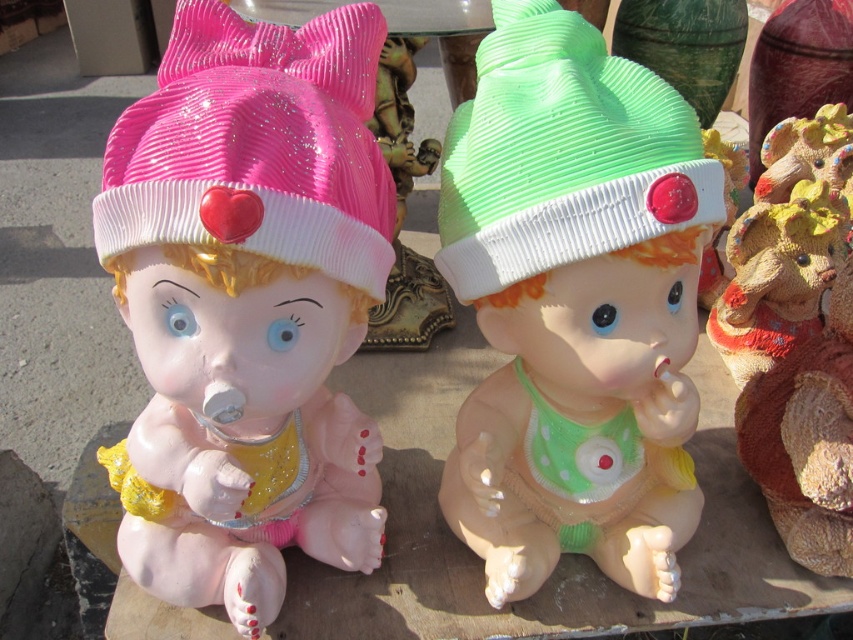
Question: Among these points, which one is nearest to the camera?

Choices:
 (A) (576, 291)
 (B) (608, 93)
 (C) (312, 40)
 (D) (752, 291)

Answer: (A)

Question: Based on their relative distances, which object is farther from the textured brown bear at right?

Choices:
 (A) pink glittery hat at left
 (B) matte green plastic baby at center
 (C) matte plastic doll at center

Answer: (A)

Question: Can you confirm if matte green plastic baby at center is positioned below pink glittery hat at left?

Choices:
 (A) yes
 (B) no

Answer: (A)

Question: Which object is positioned farthest from the matte plastic doll at center?

Choices:
 (A) matte green plastic baby at center
 (B) textured brown bear at right
 (C) green matte knit hat at center
 (D) pink glittery hat at left

Answer: (B)

Question: Can you confirm if pink glittery hat at left is wider than textured brown bear at right?

Choices:
 (A) no
 (B) yes

Answer: (A)

Question: Is matte plastic doll at center positioned behind matte green plastic baby at center?

Choices:
 (A) no
 (B) yes

Answer: (A)